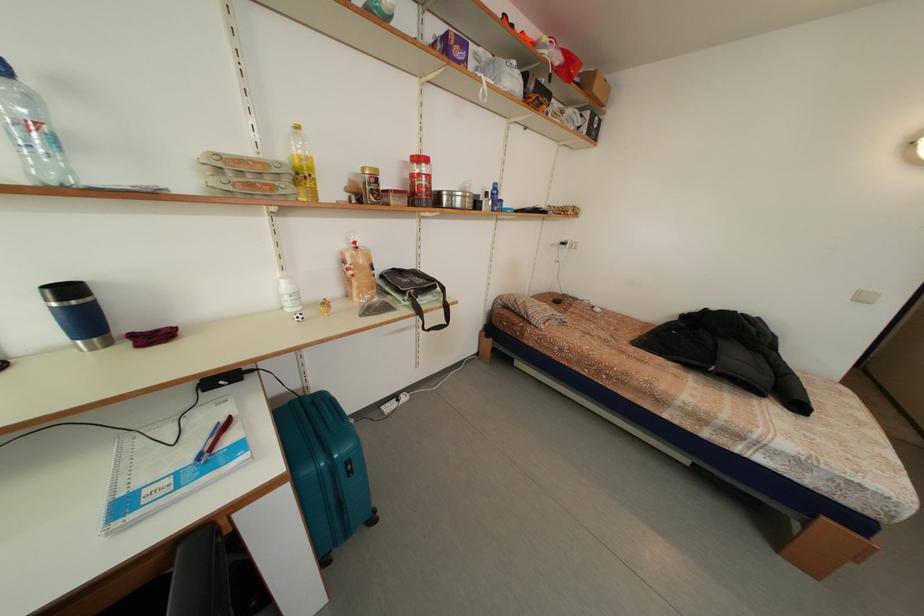
Locate an element on the screen. teal suitcase handle is located at coordinates (325, 413).